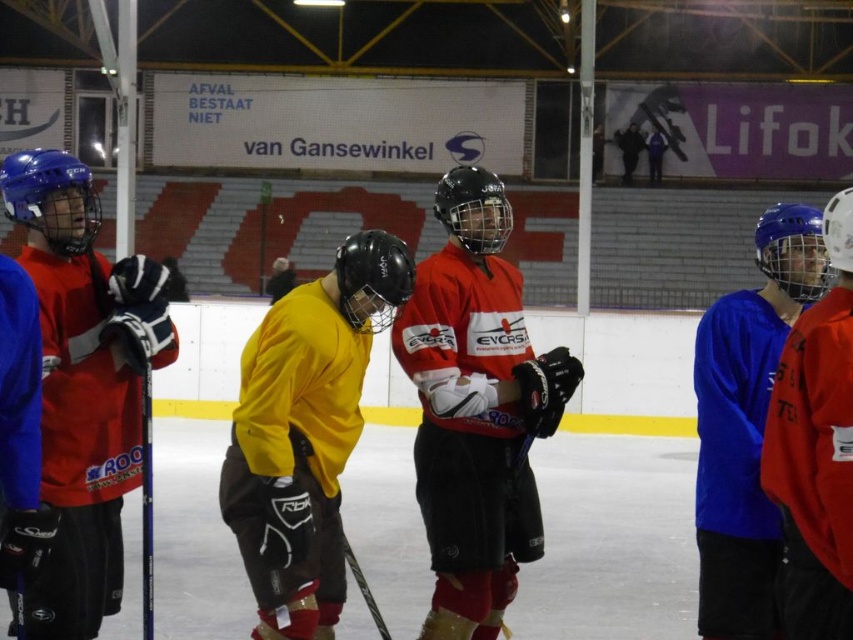
Based on the photo, you are a coach observing the practice session and need to retrieve both the matte red hockey jersey at center and the matte blue hockey stick at left. If your reach is 1.5 meters, can you grab both items without moving your position?

The matte red hockey jersey at center and the matte blue hockey stick at left are 1.81 meters apart, so you cannot grab both items without moving since your reach is only 1.5 meters.

You are an ice hockey player standing at the center of the rink. You need to move towards the point marked at point (x=712, y=332) and point (x=827, y=492). Which point will you reach first if you move straight ahead?

You will reach point (x=712, y=332) first because it is closer to you than point (x=827, y=492).

You are an ice hockey player standing at the point labeled as point (640, 148). You want to skate towards the point labeled as point (35, 419). Will you be moving forward or backward relative to the direction you are facing?

Since point (35, 419) is in front of point (640, 148), you will be moving forward relative to the direction you are facing.